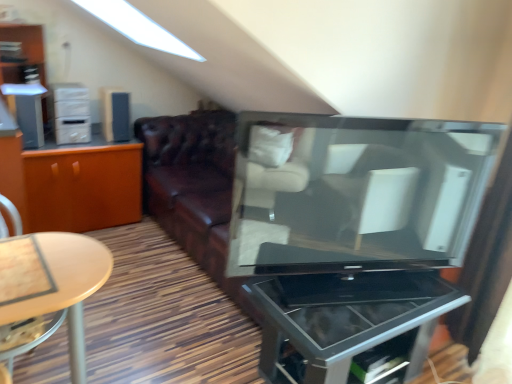
Question: Does metallic glass tv stand at center have a larger size compared to matte black television at center?

Choices:
 (A) no
 (B) yes

Answer: (B)

Question: From a real-world perspective, is metallic glass tv stand at center positioned over matte black television at center based on gravity?

Choices:
 (A) yes
 (B) no

Answer: (B)

Question: Is metallic glass tv stand at center closer to the viewer compared to matte black television at center?

Choices:
 (A) no
 (B) yes

Answer: (B)

Question: Can you confirm if metallic glass tv stand at center is smaller than matte black television at center?

Choices:
 (A) yes
 (B) no

Answer: (B)

Question: Is metallic glass tv stand at center facing towards matte black television at center?

Choices:
 (A) yes
 (B) no

Answer: (B)

Question: In terms of size, does orange wood cabinet at left appear bigger or smaller than metallic glass tv stand at center?

Choices:
 (A) small
 (B) big

Answer: (B)

Question: Is orange wood cabinet at left wider or thinner than metallic glass tv stand at center?

Choices:
 (A) wide
 (B) thin

Answer: (A)

Question: Is orange wood cabinet at left taller or shorter than metallic glass tv stand at center?

Choices:
 (A) tall
 (B) short

Answer: (A)

Question: Based on their positions, is orange wood cabinet at left located to the left or right of metallic glass tv stand at center?

Choices:
 (A) left
 (B) right

Answer: (A)

Question: Does point (248, 162) appear closer or farther from the camera than point (28, 33)?

Choices:
 (A) farther
 (B) closer

Answer: (B)

Question: From their relative heights in the image, would you say matte black television at center is taller or shorter than matte white dresser at upper left?

Choices:
 (A) short
 (B) tall

Answer: (A)

Question: Which is correct: matte black television at center is inside matte white dresser at upper left, or outside of it?

Choices:
 (A) inside
 (B) outside

Answer: (B)

Question: From the image's perspective, is matte black television at center positioned above or below matte white dresser at upper left?

Choices:
 (A) below
 (B) above

Answer: (A)

Question: Considering the positions of satin silver speaker at left, which is the 1th appliance in front-to-back order, and white plastic cabinet at left in the image, is satin silver speaker at left, which is the 1th appliance in front-to-back order, wider or thinner than white plastic cabinet at left?

Choices:
 (A) thin
 (B) wide

Answer: (B)

Question: From a real-world perspective, is satin silver speaker at left, which is counted as the 1th appliance, starting from the left, above or below white plastic cabinet at left?

Choices:
 (A) above
 (B) below

Answer: (B)